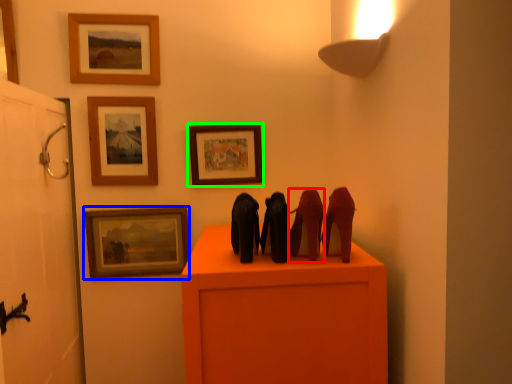
Question: Estimate the real-world distances between objects in this image. Which object is closer to animal (highlighted by a red box), picture frame (highlighted by a blue box) or picture frame (highlighted by a green box)?

Choices:
 (A) picture frame
 (B) picture frame

Answer: (B)